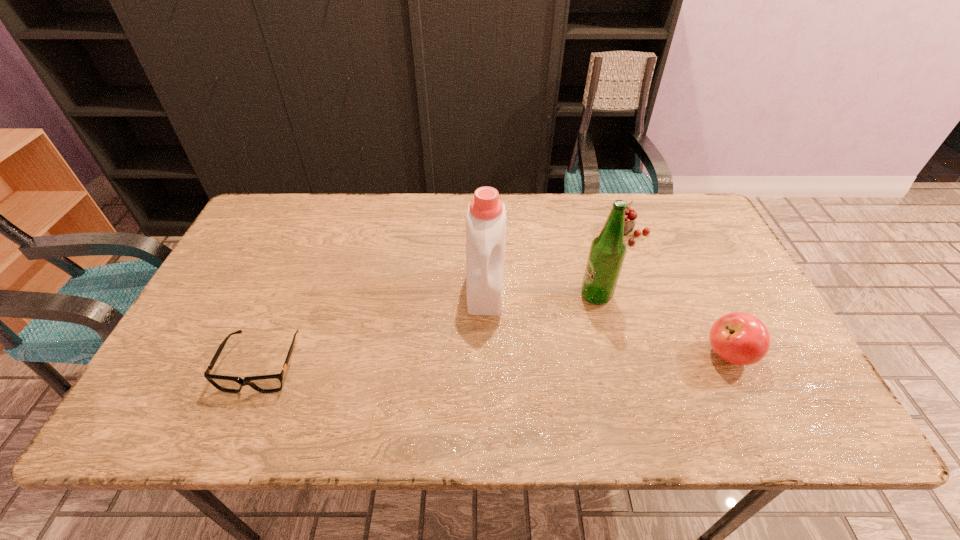
Locate an element on the screen. This screenshot has width=960, height=540. sunglasses is located at coordinates (272, 383).

Locate an element on the screen. The width and height of the screenshot is (960, 540). the leftmost object is located at coordinates (272, 383).

I want to click on apple, so click(x=740, y=338).

You are a GUI agent. You are given a task and a screenshot of the screen. Output one action in this format:
    pyautogui.click(x=<x>, y=<y>)
    Task: Click on the farthest object
    This screenshot has height=540, width=960.
    Given the screenshot: What is the action you would take?
    pyautogui.click(x=630, y=214)

Where is `pot filled with cherries`? The height and width of the screenshot is (540, 960). pot filled with cherries is located at coordinates (630, 214).

At what (x,y) coordinates should I click in order to perform the action: click on detergent. Please return your answer as a coordinate pair (x, y). The image size is (960, 540). Looking at the image, I should click on (486, 215).

This screenshot has height=540, width=960. What are the coordinates of `the third object from right to left` in the screenshot? It's located at (607, 252).

Locate an element on the screen. vacant space located 0.280m on the back of the apple is located at coordinates (683, 257).

Find the location of a particular element. The width and height of the screenshot is (960, 540). free spot located 0.350m on the handle side of the farthest object is located at coordinates pyautogui.click(x=536, y=303).

Where is `vacant space located 0.110m on the handle side of the farthest object`? vacant space located 0.110m on the handle side of the farthest object is located at coordinates (589, 260).